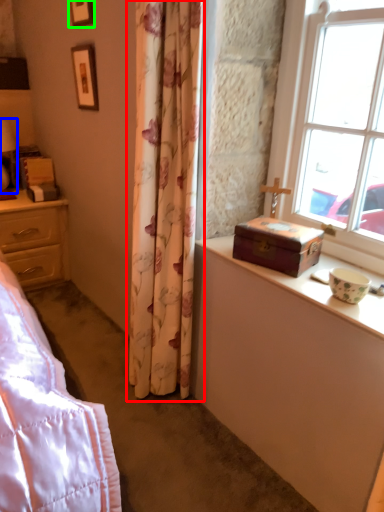
Question: Estimate the real-world distances between objects in this image. Which object is closer to curtain (highlighted by a red box), table lamp (highlighted by a blue box) or picture frame (highlighted by a green box)?

Choices:
 (A) table lamp
 (B) picture frame

Answer: (B)